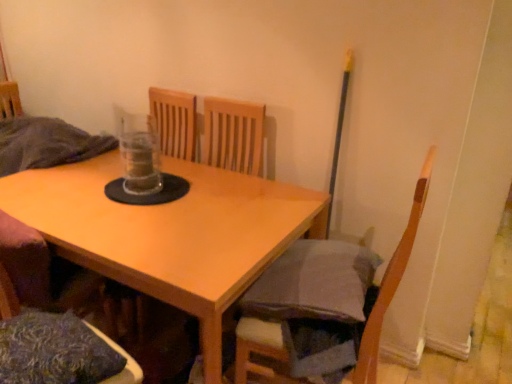
Identify the location of light wood table at center. The height and width of the screenshot is (384, 512). (170, 233).

Locate an element on the screen. This screenshot has width=512, height=384. wooden chair at lower right, which ranks as the 2th chair in left-to-right order is located at coordinates (391, 281).

Is textured blue pillow at lower left taller than wooden chair at lower right, marked as the 1th chair in a right-to-left arrangement?

Incorrect, the height of textured blue pillow at lower left is not larger of that of wooden chair at lower right, marked as the 1th chair in a right-to-left arrangement.

Does point (46, 333) come behind point (253, 365)?

No.

Is wooden chair at lower right, marked as the 1th chair in a right-to-left arrangement, inside textured blue pillow at lower left?

No, wooden chair at lower right, marked as the 1th chair in a right-to-left arrangement, is not a part of textured blue pillow at lower left.

How much distance is there between textured blue pillow at lower left and wooden chair at lower left, the 1th chair from the left?

A distance of 10.90 inches exists between textured blue pillow at lower left and wooden chair at lower left, the 1th chair from the left.

Would you say textured blue pillow at lower left is a long distance from wooden chair at lower left, the 1th chair from the left?

Actually, textured blue pillow at lower left and wooden chair at lower left, the 1th chair from the left, are a little close together.

From a real-world perspective, between textured blue pillow at lower left and wooden chair at lower left, the 1th chair from the left, who is vertically higher?

In real-world perspective, wooden chair at lower left, the 1th chair from the left, is above.

Is textured blue pillow at lower left in front of wooden chair at lower left, the 1th chair from the left?

No, it is not.

Which of these two, light wood table at center or textured blue pillow at lower left, is wider?

light wood table at center.

The width and height of the screenshot is (512, 384). In order to click on pillow above the light wood table at center (from a real-world perspective) in this screenshot , I will do `click(55, 351)`.

Considering the sizes of objects wooden chair at lower right, marked as the 1th chair in a right-to-left arrangement, and textured blue pillow at lower left in the image provided, who is thinner, wooden chair at lower right, marked as the 1th chair in a right-to-left arrangement, or textured blue pillow at lower left?

Thinner between the two is textured blue pillow at lower left.

From a real-world perspective, which object stands above the other?

wooden chair at lower right, marked as the 1th chair in a right-to-left arrangement, is physically above.

From their relative heights in the image, would you say wooden chair at lower right, marked as the 1th chair in a right-to-left arrangement, is taller or shorter than textured blue pillow at lower left?

Clearly, wooden chair at lower right, marked as the 1th chair in a right-to-left arrangement, is taller compared to textured blue pillow at lower left.

Considering the relative sizes of wooden chair at lower left, the 1th chair from the left, and textured blue pillow at lower left in the image provided, is wooden chair at lower left, the 1th chair from the left, thinner than textured blue pillow at lower left?

Correct, the width of wooden chair at lower left, the 1th chair from the left, is less than that of textured blue pillow at lower left.

From the image's perspective, is wooden chair at lower left, the 1th chair from the left, positioned above or below textured blue pillow at lower left?

From the image's perspective, wooden chair at lower left, the 1th chair from the left, appears above textured blue pillow at lower left.

Is wooden chair at lower left, acting as the 2th chair starting from the right, to the right of textured blue pillow at lower left from the viewer's perspective?

No, wooden chair at lower left, acting as the 2th chair starting from the right, is not to the right of textured blue pillow at lower left.

Does wooden chair at lower left, acting as the 2th chair starting from the right, have a smaller size compared to textured blue pillow at lower left?

No.

Is wooden chair at lower right, which ranks as the 2th chair in left-to-right order, aimed at light wood table at center?

Yes, wooden chair at lower right, which ranks as the 2th chair in left-to-right order, is turned towards light wood table at center.

How far apart are wooden chair at lower right, which ranks as the 2th chair in left-to-right order, and light wood table at center?

The distance of wooden chair at lower right, which ranks as the 2th chair in left-to-right order, from light wood table at center is 20.83 inches.

Considering the positions of objects wooden chair at lower right, marked as the 1th chair in a right-to-left arrangement, and light wood table at center in the image provided, who is in front, wooden chair at lower right, marked as the 1th chair in a right-to-left arrangement, or light wood table at center?

wooden chair at lower right, marked as the 1th chair in a right-to-left arrangement, is more forward.

Does wooden chair at lower right, marked as the 1th chair in a right-to-left arrangement, have a lesser width compared to light wood table at center?

Indeed, wooden chair at lower right, marked as the 1th chair in a right-to-left arrangement, has a lesser width compared to light wood table at center.

Can you confirm if wooden chair at lower left, the 1th chair from the left, is thinner than light wood table at center?

Yes.

The height and width of the screenshot is (384, 512). Identify the location of chair on the left of light wood table at center. (32, 270).

Does wooden chair at lower left, the 1th chair from the left, appear on the left side of light wood table at center?

Yes.

From the image's perspective, which one is positioned lower, wooden chair at lower left, the 1th chair from the left, or light wood table at center?

wooden chair at lower left, the 1th chair from the left, appears lower in the image.

Find the location of a particular element. Image resolution: width=512 pixels, height=384 pixels. chair behind the textured blue pillow at lower left is located at coordinates (391, 281).

The image size is (512, 384). What are the coordinates of `chair lying in front of the textured blue pillow at lower left` in the screenshot? It's located at (32, 270).

Based on their spatial positions, is wooden chair at lower right, which ranks as the 2th chair in left-to-right order, or textured blue pillow at lower left closer to wooden chair at lower left, acting as the 2th chair starting from the right?

textured blue pillow at lower left.

Considering their positions, is wooden chair at lower left, the 1th chair from the left, positioned further to wooden chair at lower right, marked as the 1th chair in a right-to-left arrangement, than light wood table at center?

wooden chair at lower left, the 1th chair from the left, lies further to wooden chair at lower right, marked as the 1th chair in a right-to-left arrangement, than the other object.

Estimate the real-world distances between objects in this image. Which object is closer to wooden chair at lower right, marked as the 1th chair in a right-to-left arrangement, light wood table at center or wooden chair at lower left, acting as the 2th chair starting from the right?

Based on the image, light wood table at center appears to be nearer to wooden chair at lower right, marked as the 1th chair in a right-to-left arrangement.

Estimate the real-world distances between objects in this image. Which object is further from light wood table at center, wooden chair at lower left, the 1th chair from the left, or textured blue pillow at lower left?

textured blue pillow at lower left.

Estimate the real-world distances between objects in this image. Which object is further from light wood table at center, wooden chair at lower right, which ranks as the 2th chair in left-to-right order, or textured blue pillow at lower left?

wooden chair at lower right, which ranks as the 2th chair in left-to-right order, lies further to light wood table at center than the other object.

Based on their spatial positions, is textured blue pillow at lower left or light wood table at center further from wooden chair at lower right, which ranks as the 2th chair in left-to-right order?

textured blue pillow at lower left.

From the image, which object appears to be farther from wooden chair at lower right, which ranks as the 2th chair in left-to-right order, wooden chair at lower left, the 1th chair from the left, or textured blue pillow at lower left?

Based on the image, wooden chair at lower left, the 1th chair from the left, appears to be further to wooden chair at lower right, which ranks as the 2th chair in left-to-right order.

Based on their spatial positions, is wooden chair at lower right, which ranks as the 2th chair in left-to-right order, or light wood table at center further from wooden chair at lower left, acting as the 2th chair starting from the right?

Based on the image, wooden chair at lower right, which ranks as the 2th chair in left-to-right order, appears to be further to wooden chair at lower left, acting as the 2th chair starting from the right.

You are a GUI agent. You are given a task and a screenshot of the screen. Output one action in this format:
    pyautogui.click(x=<x>, y=<y>)
    Task: Click on the table between wooden chair at lower left, acting as the 2th chair starting from the right, and wooden chair at lower right, which ranks as the 2th chair in left-to-right order, from left to right
    The width and height of the screenshot is (512, 384).
    Given the screenshot: What is the action you would take?
    pyautogui.click(x=170, y=233)

Locate an element on the screen. Image resolution: width=512 pixels, height=384 pixels. pillow situated between wooden chair at lower left, acting as the 2th chair starting from the right, and wooden chair at lower right, marked as the 1th chair in a right-to-left arrangement, from left to right is located at coordinates (55, 351).

Identify the location of table between textured blue pillow at lower left and wooden chair at lower right, which ranks as the 2th chair in left-to-right order, in the horizontal direction. (170, 233).

Where is `pillow between wooden chair at lower left, the 1th chair from the left, and light wood table at center from front to back`? This screenshot has width=512, height=384. pillow between wooden chair at lower left, the 1th chair from the left, and light wood table at center from front to back is located at coordinates (55, 351).